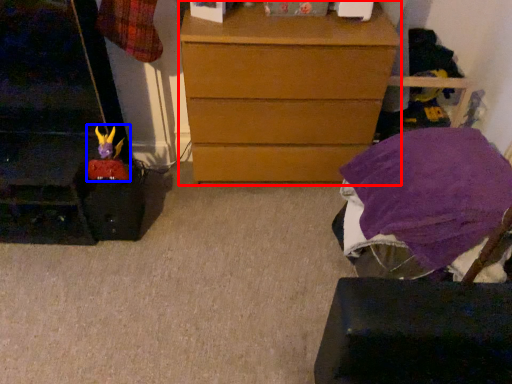
Question: Which point is further to the camera, chest of drawers (highlighted by a red box) or toy (highlighted by a blue box)?

Choices:
 (A) chest of drawers
 (B) toy

Answer: (B)